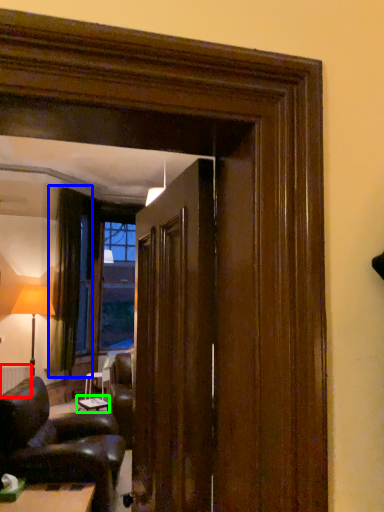
Question: Considering the real-world distances, which object is farthest from radiator (highlighted by a red box)? curtain (highlighted by a blue box) or table (highlighted by a green box)?

Choices:
 (A) curtain
 (B) table

Answer: (A)